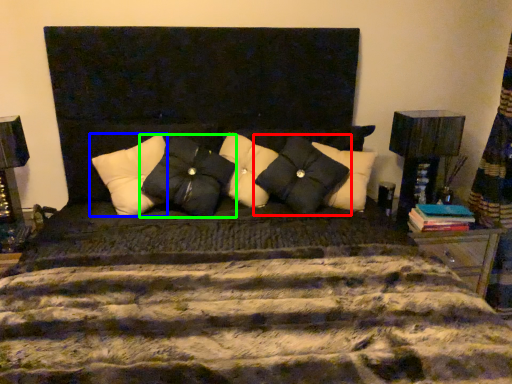
Question: Considering the real-world distances, which object is closest to pillow (highlighted by a red box)? pillow (highlighted by a blue box) or pillow (highlighted by a green box).

Choices:
 (A) pillow
 (B) pillow

Answer: (B)